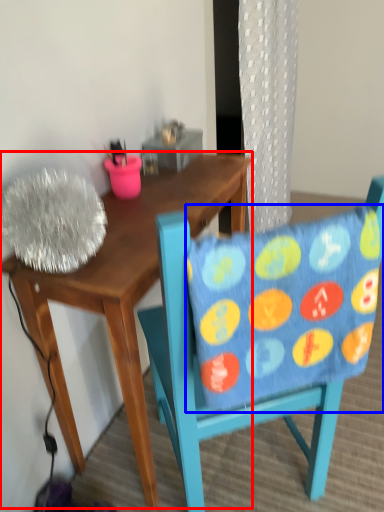
Question: Which of the following is the closest to the observer, desk (highlighted by a red box) or pillow (highlighted by a blue box)?

Choices:
 (A) desk
 (B) pillow

Answer: (B)